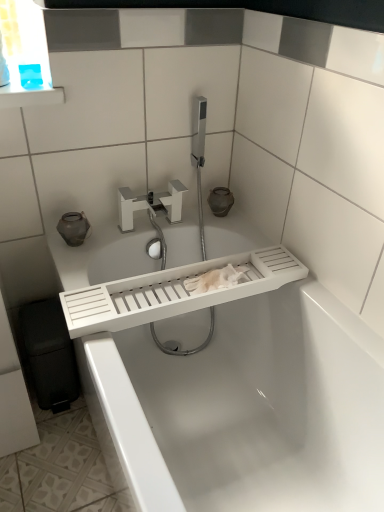
Question: Considering the relative sizes of white matte faucet at center and white plastic bathtub at center in the image provided, is white matte faucet at center bigger than white plastic bathtub at center?

Choices:
 (A) no
 (B) yes

Answer: (A)

Question: Considering the relative sizes of white matte faucet at center and white plastic bathtub at center in the image provided, is white matte faucet at center shorter than white plastic bathtub at center?

Choices:
 (A) no
 (B) yes

Answer: (B)

Question: Is white matte faucet at center in contact with white plastic bathtub at center?

Choices:
 (A) yes
 (B) no

Answer: (B)

Question: From a real-world perspective, is white matte faucet at center on white plastic bathtub at center?

Choices:
 (A) yes
 (B) no

Answer: (A)

Question: Can you confirm if white matte faucet at center is smaller than white plastic bathtub at center?

Choices:
 (A) no
 (B) yes

Answer: (B)

Question: Considering the relative positions of white matte faucet at center and white plastic bathtub at center in the image provided, is white matte faucet at center to the right of white plastic bathtub at center from the viewer's perspective?

Choices:
 (A) yes
 (B) no

Answer: (B)

Question: Can you confirm if white plastic bathtub at center is taller than white matte faucet at center?

Choices:
 (A) yes
 (B) no

Answer: (A)

Question: Does white plastic bathtub at center have a lesser height compared to white matte faucet at center?

Choices:
 (A) yes
 (B) no

Answer: (B)

Question: Is white plastic bathtub at center positioned beyond the bounds of white matte faucet at center?

Choices:
 (A) no
 (B) yes

Answer: (B)

Question: Considering the relative positions of white plastic bathtub at center and white matte faucet at center in the image provided, is white plastic bathtub at center to the left of white matte faucet at center from the viewer's perspective?

Choices:
 (A) no
 (B) yes

Answer: (A)

Question: Is white plastic bathtub at center touching white matte faucet at center?

Choices:
 (A) yes
 (B) no

Answer: (B)

Question: From a real-world perspective, is white plastic bathtub at center on white matte faucet at center?

Choices:
 (A) no
 (B) yes

Answer: (A)

Question: Considering the positions of white plastic bathtub at center and white matte faucet at center in the image, is white plastic bathtub at center wider or thinner than white matte faucet at center?

Choices:
 (A) thin
 (B) wide

Answer: (B)